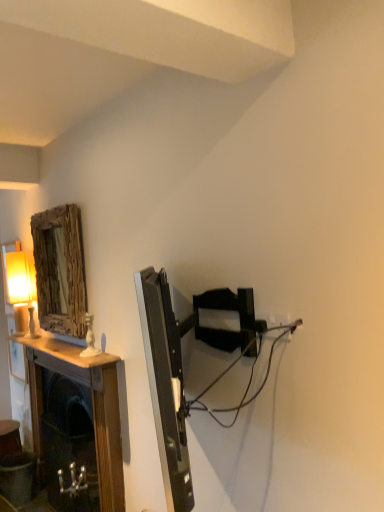
Question: Considering the relative positions of wooden mantel at left and matte cream table lamp at left in the image provided, is wooden mantel at left to the right of matte cream table lamp at left from the viewer's perspective?

Choices:
 (A) yes
 (B) no

Answer: (A)

Question: Is wooden mantel at left at the left side of matte cream table lamp at left?

Choices:
 (A) yes
 (B) no

Answer: (B)

Question: Is matte cream table lamp at left a part of wooden mantel at left?

Choices:
 (A) yes
 (B) no

Answer: (B)

Question: Is wooden mantel at left outside matte cream table lamp at left?

Choices:
 (A) yes
 (B) no

Answer: (A)

Question: Does wooden mantel at left lie in front of matte cream table lamp at left?

Choices:
 (A) no
 (B) yes

Answer: (B)

Question: Is wooden textured mirror at upper left situated inside matte cream table lamp at left or outside?

Choices:
 (A) inside
 (B) outside

Answer: (B)

Question: From the image's perspective, is wooden textured mirror at upper left positioned above or below matte cream table lamp at left?

Choices:
 (A) below
 (B) above

Answer: (B)

Question: Relative to matte cream table lamp at left, is wooden textured mirror at upper left in front or behind?

Choices:
 (A) front
 (B) behind

Answer: (A)

Question: In terms of height, does wooden textured mirror at upper left look taller or shorter compared to matte cream table lamp at left?

Choices:
 (A) short
 (B) tall

Answer: (B)

Question: Is matte cream table lamp at left wider or thinner than wooden textured mirror at upper left?

Choices:
 (A) thin
 (B) wide

Answer: (B)

Question: Is matte cream table lamp at left bigger or smaller than wooden textured mirror at upper left?

Choices:
 (A) small
 (B) big

Answer: (A)

Question: Is point (28, 265) positioned closer to the camera than point (51, 287)?

Choices:
 (A) closer
 (B) farther

Answer: (B)

Question: In the image, is matte cream table lamp at left positioned in front of or behind wooden textured mirror at upper left?

Choices:
 (A) front
 (B) behind

Answer: (B)

Question: Looking at their shapes, would you say black plastic cable at center right is wider or thinner than wooden textured mirror at upper left?

Choices:
 (A) thin
 (B) wide

Answer: (B)

Question: From their relative heights in the image, would you say black plastic cable at center right is taller or shorter than wooden textured mirror at upper left?

Choices:
 (A) short
 (B) tall

Answer: (A)